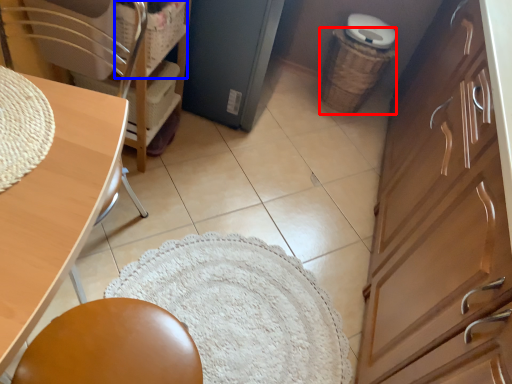
Question: Which point is closer to the camera, basket (highlighted by a red box) or basket (highlighted by a blue box)?

Choices:
 (A) basket
 (B) basket

Answer: (B)